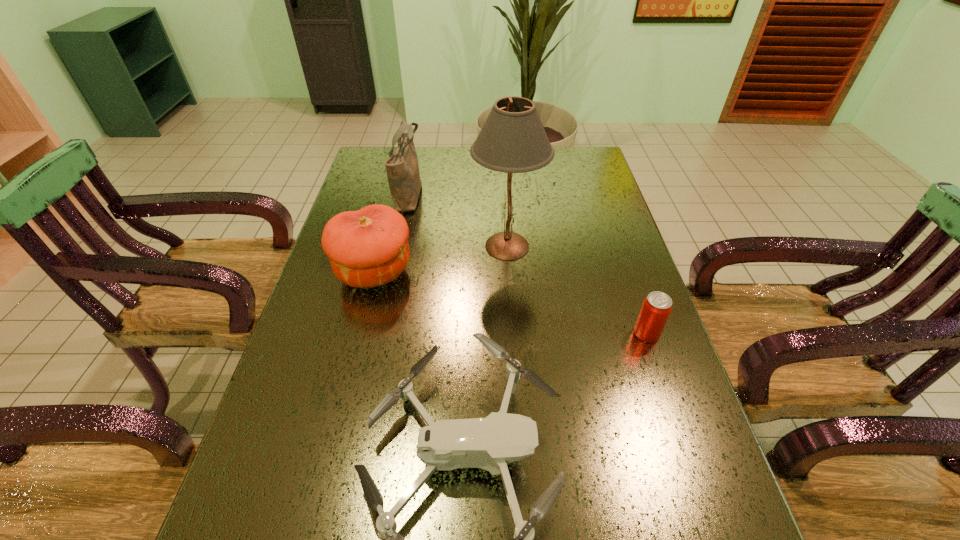
Where is `vacant space located on the right of the third tallest object`? vacant space located on the right of the third tallest object is located at coordinates [x=527, y=272].

The image size is (960, 540). Find the location of `blank space located on the back of the can`. blank space located on the back of the can is located at coordinates (620, 258).

The image size is (960, 540). I want to click on object positioned at the far edge, so click(402, 168).

Where is `shoulder bag present at the left edge`? The height and width of the screenshot is (540, 960). shoulder bag present at the left edge is located at coordinates (402, 168).

You are a GUI agent. You are given a task and a screenshot of the screen. Output one action in this format:
    pyautogui.click(x=<x>, y=<y>)
    Task: Click on the pumpkin that is at the left edge
    The height and width of the screenshot is (540, 960).
    Given the screenshot: What is the action you would take?
    pyautogui.click(x=367, y=248)

What are the coordinates of `object present at the right edge` in the screenshot? It's located at (657, 306).

Locate an element on the screen. The width and height of the screenshot is (960, 540). object at the far left corner is located at coordinates (402, 168).

In the image, there is a desktop. Where is `vacant area at the far edge`? The height and width of the screenshot is (540, 960). vacant area at the far edge is located at coordinates (529, 176).

The image size is (960, 540). I want to click on free point at the left edge, so click(323, 349).

The image size is (960, 540). I want to click on blank area at the right edge, so click(x=577, y=264).